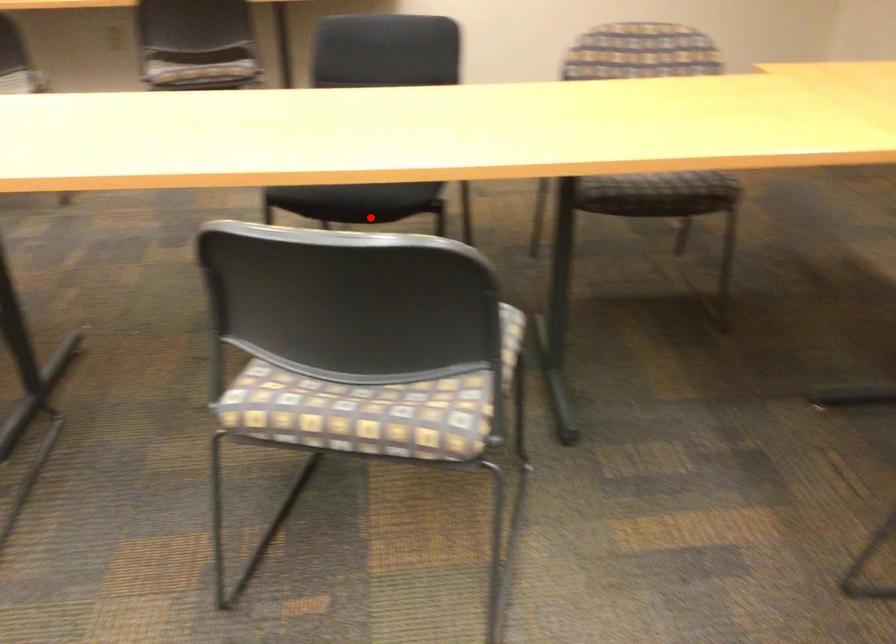
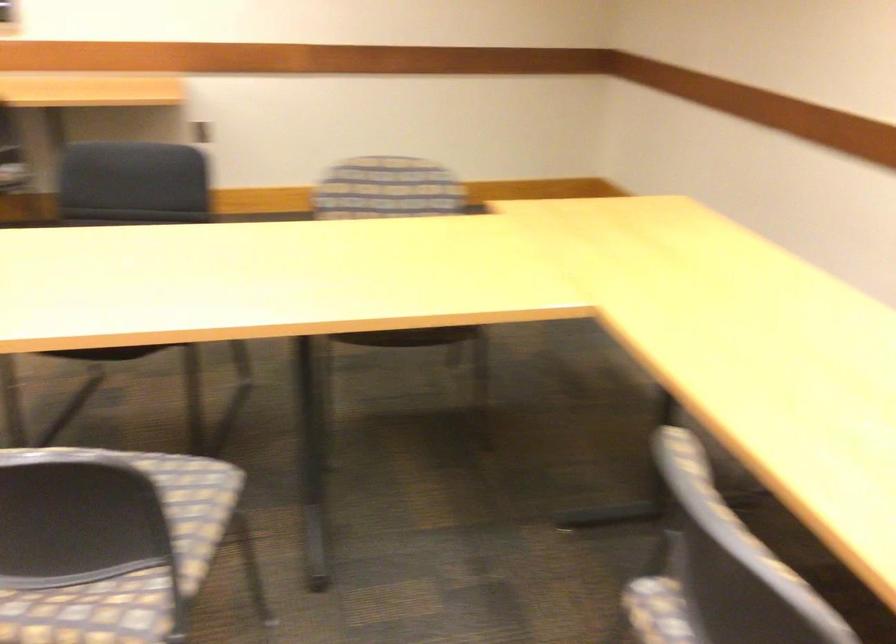
Locate, in the second image, the point that corresponds to the highlighted location in the first image.

(106, 353)